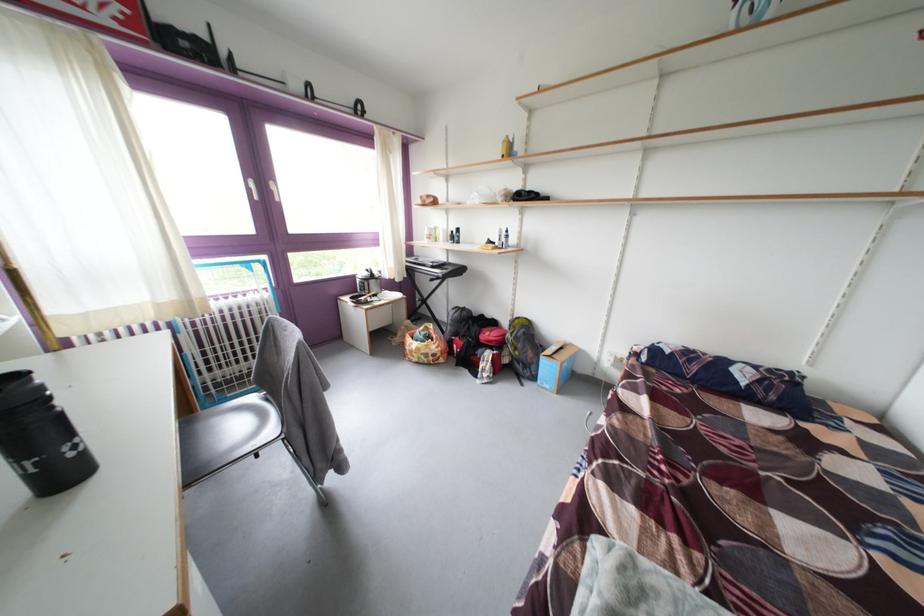
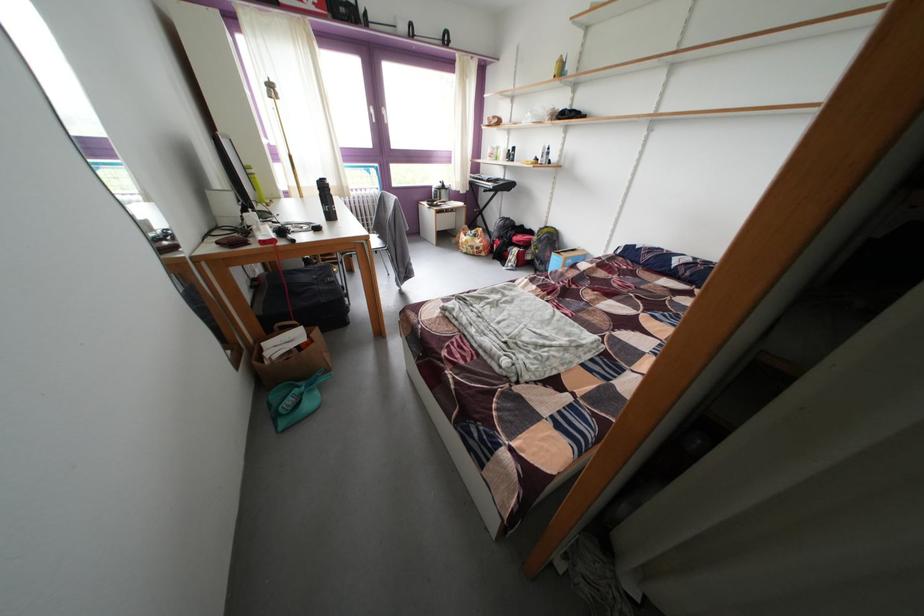
Find the pixel in the second image that matches pixel 434 270 in the first image.

(492, 185)